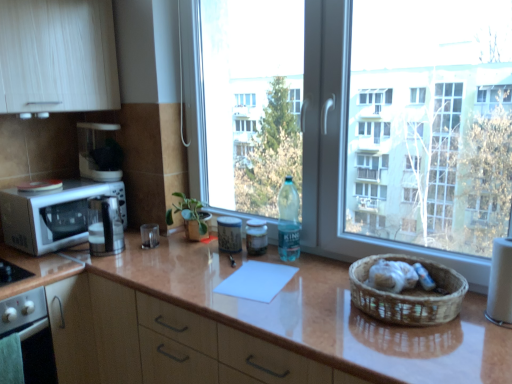
Identify the location of free space in front of brown woven basket at right. The height and width of the screenshot is (384, 512). (428, 352).